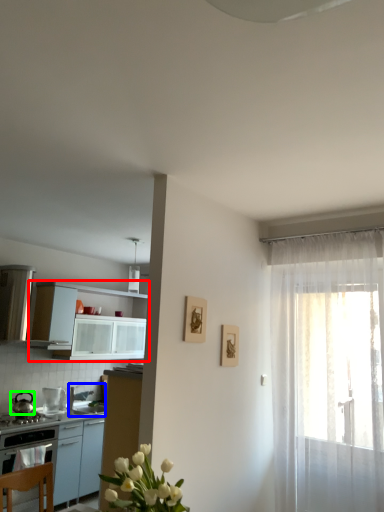
Question: Which object is the closest to the cabinetry (highlighted by a red box)? Choose among these: sink (highlighted by a blue box) or kitchen appliance (highlighted by a green box).

Choices:
 (A) sink
 (B) kitchen appliance

Answer: (A)